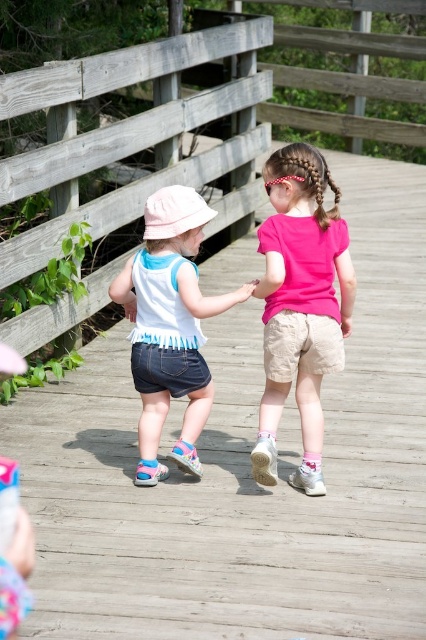
Question: Does wooden bridge at center appear over pink fabric hand at center?

Choices:
 (A) yes
 (B) no

Answer: (A)

Question: Is wooden bridge at center positioned before pink fabric hand at center?

Choices:
 (A) no
 (B) yes

Answer: (A)

Question: Which object appears farthest from the camera in this image?

Choices:
 (A) denim shorts at center
 (B) pink matte shorts at center
 (C) pink fabric hand at center
 (D) wooden bridge at center

Answer: (D)

Question: Which object is the closest to the pink fabric hand at center?

Choices:
 (A) pink matte shorts at center
 (B) wooden bridge at center

Answer: (A)

Question: Is wooden bridge at center smaller than denim shorts at center?

Choices:
 (A) yes
 (B) no

Answer: (B)

Question: Which point appears closest to the camera in this image?

Choices:
 (A) (359, 116)
 (B) (271, 307)
 (C) (255, 282)
 (D) (126, 307)

Answer: (C)